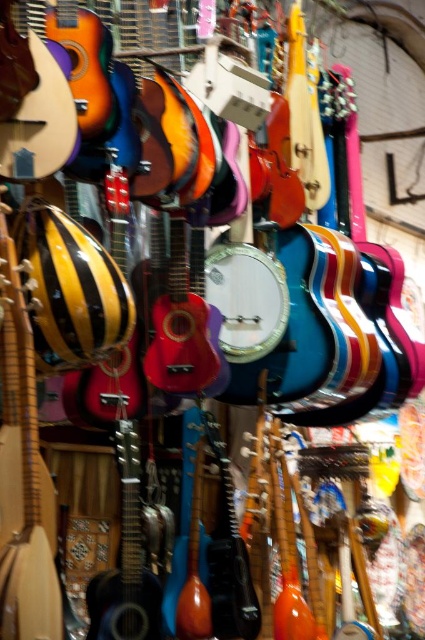
Question: Does matte yellow wood guitar at left appear on the left side of matte black guitar at center?

Choices:
 (A) yes
 (B) no

Answer: (A)

Question: Is matte yellow wood guitar at left smaller than matte black guitar at center?

Choices:
 (A) no
 (B) yes

Answer: (B)

Question: Observing the image, what is the correct spatial positioning of matte yellow wood guitar at left in reference to matte black guitar at center?

Choices:
 (A) above
 (B) below

Answer: (A)

Question: Which of the following is the farthest from the observer?

Choices:
 (A) (119, 428)
 (B) (2, 342)

Answer: (A)

Question: Which point appears farthest from the camera in this image?

Choices:
 (A) (31, 612)
 (B) (136, 493)

Answer: (B)

Question: Which of the following is the closest to the observer?

Choices:
 (A) matte yellow wood guitar at left
 (B) matte black guitar at center

Answer: (A)